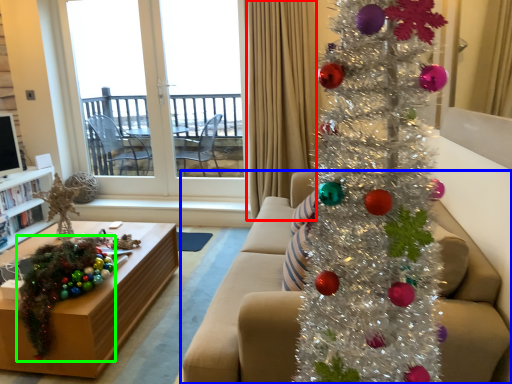
Question: Which object is the closest to the curtain (highlighted by a red box)? Choose among these: studio couch (highlighted by a blue box) or christmas decoration (highlighted by a green box).

Choices:
 (A) studio couch
 (B) christmas decoration

Answer: (A)